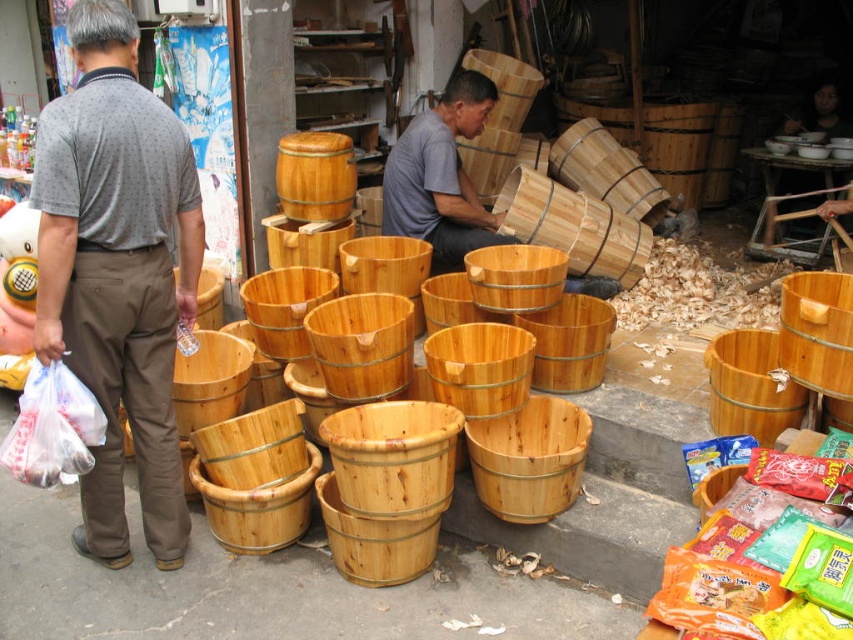
You are standing in the market scene and notice two items of interest. You want to pick up the matte gray shirt at left and the wooden bucket at center. Based on their positions, which item is closer to your left side?

The matte gray shirt at left is to the left of the wooden bucket at center, so when you are facing the scene, the matte gray shirt at left is closer to your left side.

You are standing in the market scene and want to take a photo of the two points mentioned. Which point, point (149, 397) or point (200, 307), will appear larger in your photo?

Point (149, 397) will appear larger in the photo because it is closer to the camera than point (200, 307).